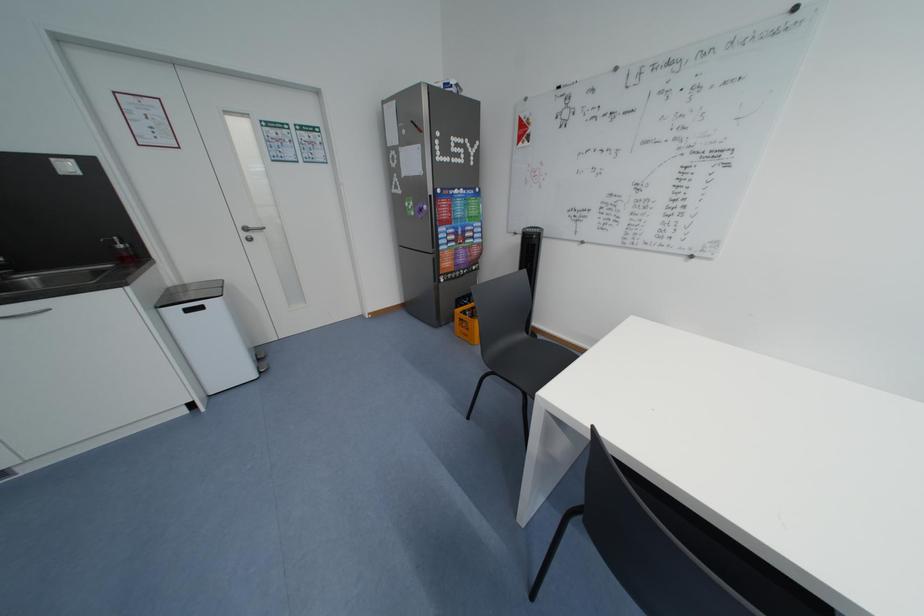
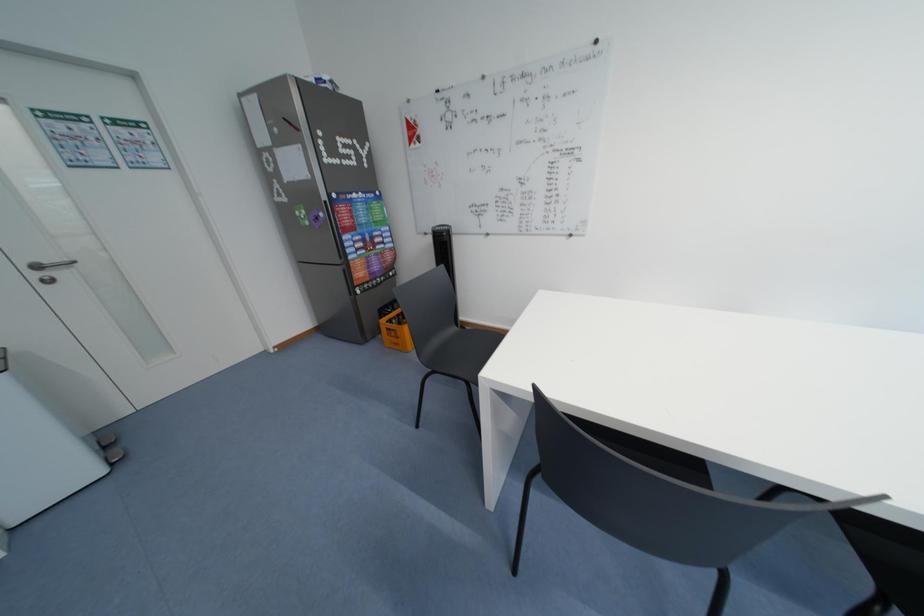
Question: Based on the continuous images, in which direction is the camera rotating? Reply with the corresponding letter.

Choices:
 (A) Left
 (B) Right
 (C) Up
 (D) Down

Answer: (B)